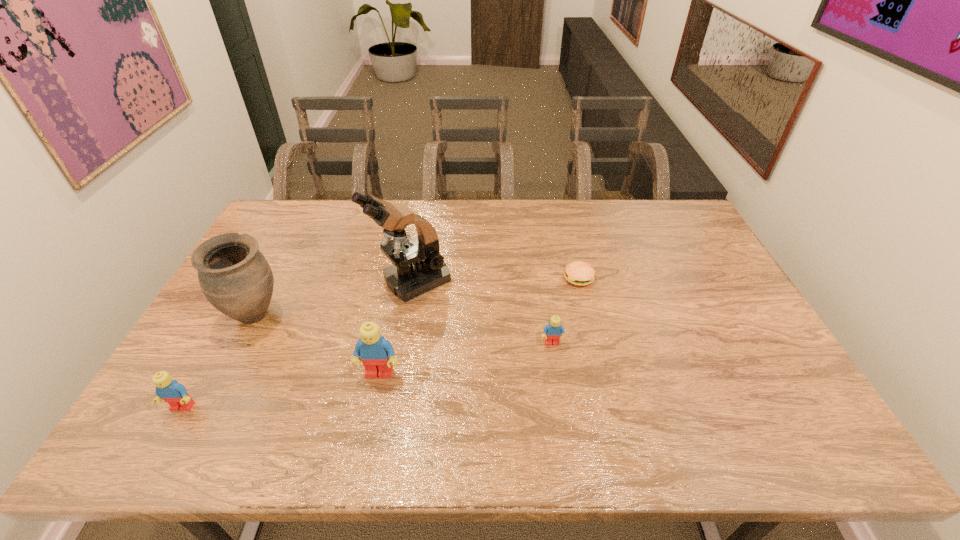
Locate an element on the screen. The image size is (960, 540). the nearest Lego is located at coordinates (171, 391).

Identify the location of the leftmost Lego. The image size is (960, 540). (171, 391).

Locate an element on the screen. The height and width of the screenshot is (540, 960). the second nearest object is located at coordinates (377, 354).

Find the location of a particular element. the second farthest Lego is located at coordinates (377, 354).

The width and height of the screenshot is (960, 540). In order to click on the fifth object from left to right in this screenshot , I will do `click(552, 332)`.

At what (x,y) coordinates should I click in order to perform the action: click on the farthest Lego. Please return your answer as a coordinate pair (x, y). The width and height of the screenshot is (960, 540). Looking at the image, I should click on (552, 332).

Identify the location of the tallest object. The image size is (960, 540). (419, 268).

Image resolution: width=960 pixels, height=540 pixels. Identify the location of the shortest object. (580, 273).

Where is `patty`? patty is located at coordinates (580, 273).

Image resolution: width=960 pixels, height=540 pixels. I want to click on the second tallest object, so click(235, 277).